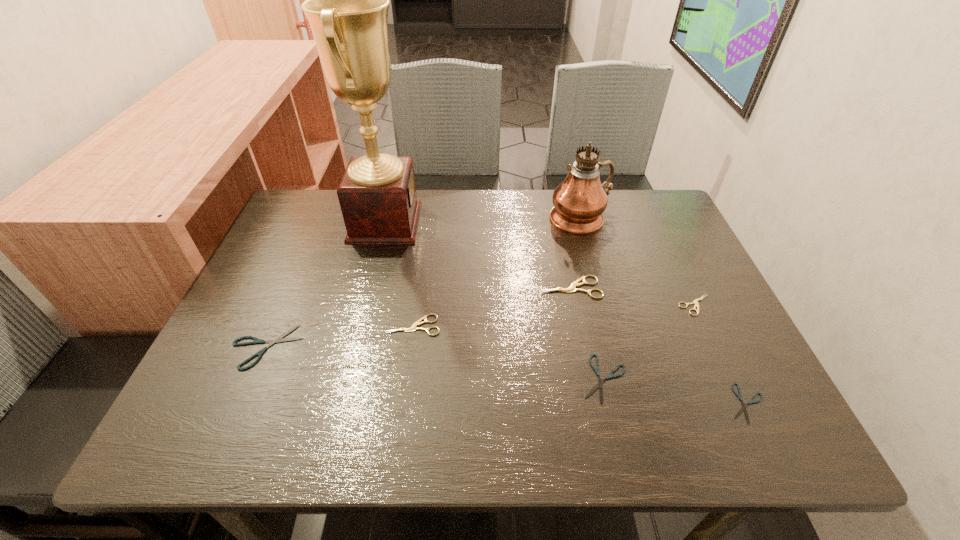
Locate an element on the screen. Image resolution: width=960 pixels, height=540 pixels. the rightmost black shears is located at coordinates (744, 408).

Find the location of a particular element. The width and height of the screenshot is (960, 540). the smallest black shears is located at coordinates (744, 408).

Image resolution: width=960 pixels, height=540 pixels. Identify the location of vacant space situated on the plaque of the tallest object. (527, 222).

In order to click on free space located on the left of the oil lamp in this screenshot , I will do `click(442, 219)`.

Locate an element on the screen. vacant space situated on the back of the tallest shears is located at coordinates (553, 205).

Image resolution: width=960 pixels, height=540 pixels. Identify the location of vacant space located 0.360m on the right of the second tallest shears. (601, 325).

Find the location of `blank space located on the right of the leftmost shears`. blank space located on the right of the leftmost shears is located at coordinates (381, 347).

You are a GUI agent. You are given a task and a screenshot of the screen. Output one action in this format:
    pyautogui.click(x=<x>, y=<y>)
    Task: Click on the vacant space situated on the back of the smallest beige shears
    The height and width of the screenshot is (540, 960).
    Given the screenshot: What is the action you would take?
    pyautogui.click(x=646, y=200)

Image resolution: width=960 pixels, height=540 pixels. Identify the location of vacant space located 0.130m on the right of the second black shears from right to left. (693, 379).

Find the location of a particular element. The image size is (960, 540). vacant region located 0.180m on the left of the shortest shears is located at coordinates (634, 403).